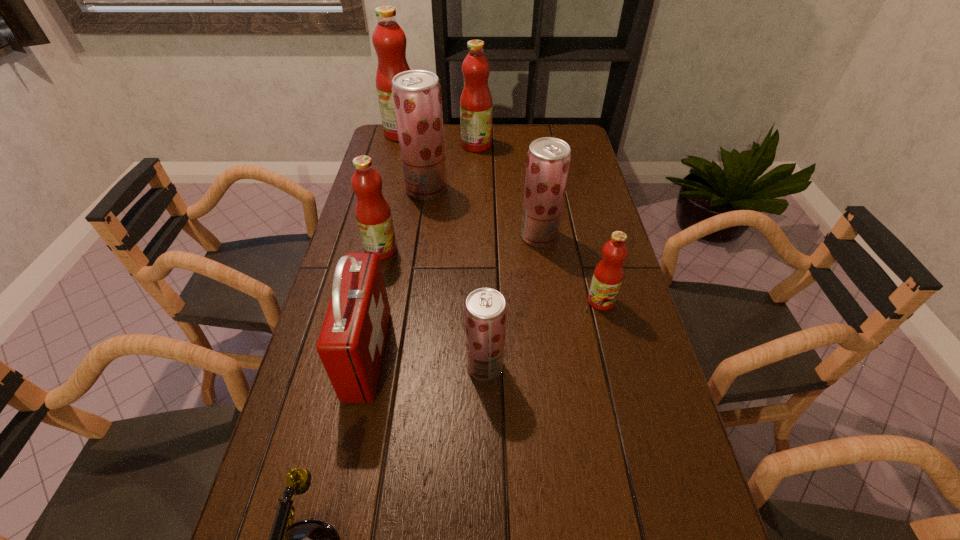
Locate an element on the screen. This screenshot has height=540, width=960. free space between the third smallest pink fruit juice and the nearest strawberry fruit juice is located at coordinates (481, 255).

Where is `unoccupied position between the nearest pink fruit juice and the fifth nearest fruit juice`? unoccupied position between the nearest pink fruit juice and the fifth nearest fruit juice is located at coordinates (514, 245).

Image resolution: width=960 pixels, height=540 pixels. Identify the location of free space between the nearest pink fruit juice and the tallest fruit juice. (501, 217).

Select which object appears as the sixth closest to the second smallest strawberry fruit juice. Please provide its 2D coordinates. Your answer should be formatted as a tuple, i.e. [(x, y)], where the tuple contains the x and y coordinates of a point satisfying the conditions above.

[(476, 106)]

Locate an element on the screen. The height and width of the screenshot is (540, 960). object that ranks as the second closest to the first-aid kit is located at coordinates (373, 214).

Locate an element on the screen. Image resolution: width=960 pixels, height=540 pixels. fruit juice that is the fourth nearest to the second biggest pink fruit juice is located at coordinates (373, 214).

Find the location of a particular element. fruit juice identified as the second closest to the third smallest pink fruit juice is located at coordinates tap(389, 40).

Find the location of a particular element. The image size is (960, 540). pink fruit juice identified as the second closest to the second fruit juice from right to left is located at coordinates (373, 214).

This screenshot has width=960, height=540. I want to click on pink fruit juice that is the nearest to the red first-aid kit, so click(x=373, y=214).

Find the location of a particular element. the second closest strawberry fruit juice to the second biggest strawberry fruit juice is located at coordinates (485, 309).